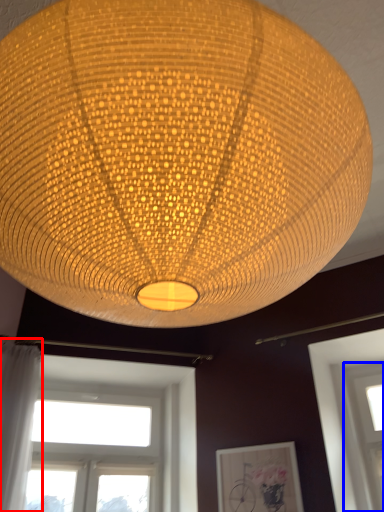
Question: Which object is further to the camera taking this photo, curtain (highlighted by a red box) or window (highlighted by a blue box)?

Choices:
 (A) curtain
 (B) window

Answer: (B)